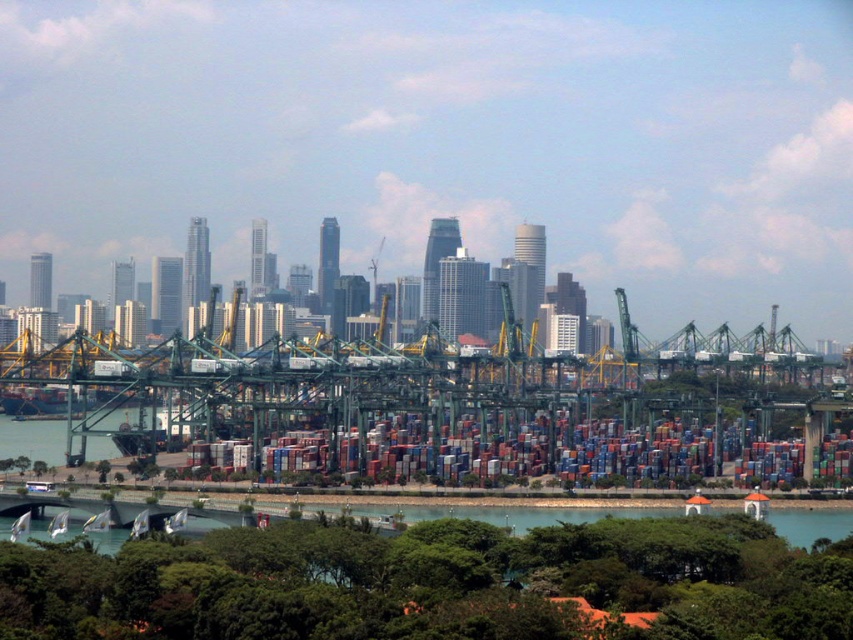
Question: Which point is farther from the camera taking this photo?

Choices:
 (A) coord(820,509)
 (B) coord(223,454)

Answer: (A)

Question: Which of the following is the closest to the observer?

Choices:
 (A) metallic containers at center
 (B) green water at lower center

Answer: (A)

Question: Does metallic containers at center come in front of green water at lower center?

Choices:
 (A) no
 (B) yes

Answer: (B)

Question: Can you confirm if metallic containers at center is positioned to the left of green water at lower center?

Choices:
 (A) no
 (B) yes

Answer: (A)

Question: Is metallic containers at center positioned before green water at lower center?

Choices:
 (A) yes
 (B) no

Answer: (A)

Question: Which of the following is the farthest from the observer?

Choices:
 (A) green water at lower center
 (B) metallic containers at center

Answer: (A)